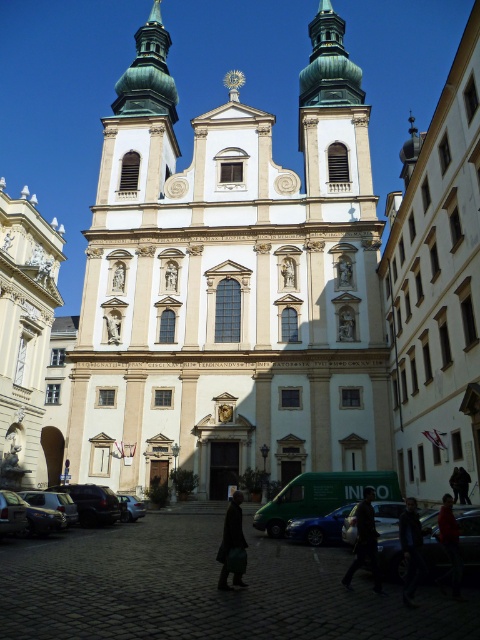
Is dark brown leather coat at center taller than shiny black sedan at lower left?

Correct, dark brown leather coat at center is much taller as shiny black sedan at lower left.

Is point (235, 531) farther from viewer compared to point (40, 534)?

No, it is in front of (40, 534).

Find the location of `dark brown leather coat at center`. dark brown leather coat at center is located at coordinates (231, 541).

Which is above, dark blue jacket at center or red leather jacket at lower right?

red leather jacket at lower right is higher up.

In the scene shown: Which is more to the left, dark blue jacket at center or red leather jacket at lower right?

From the viewer's perspective, dark blue jacket at center appears more on the left side.

Looking at this image, who is more distant from viewer, (415,518) or (454,560)?

Point (415,518)

Where is `dark blue jacket at center`? The width and height of the screenshot is (480, 640). dark blue jacket at center is located at coordinates (410, 548).

Does point (238, 531) come farther from viewer compared to point (140, 509)?

No, it is not.

Can you confirm if dark brown leather coat at center is positioned to the left of shiny silver car at center?

In fact, dark brown leather coat at center is to the right of shiny silver car at center.

The image size is (480, 640). Find the location of `dark brown leather coat at center`. dark brown leather coat at center is located at coordinates point(231,541).